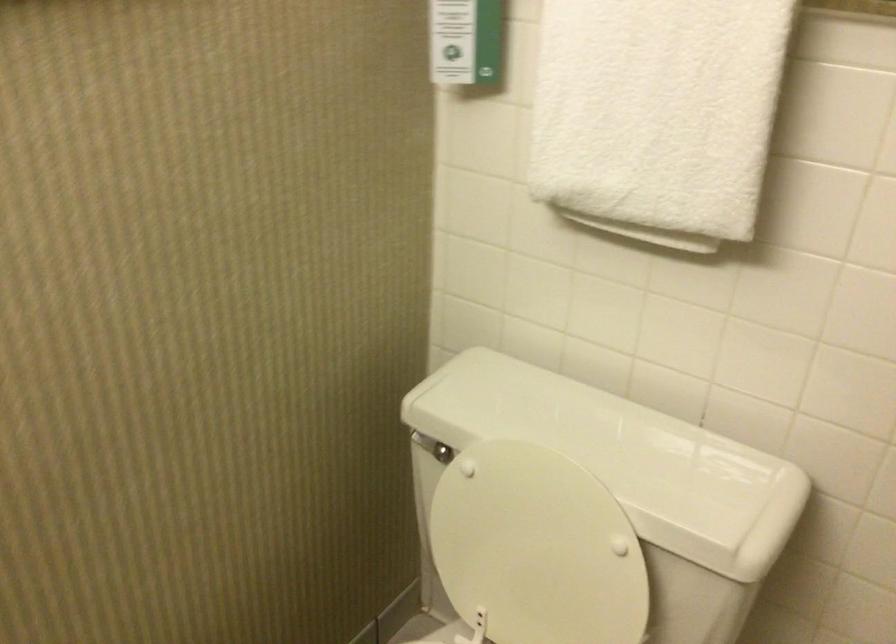
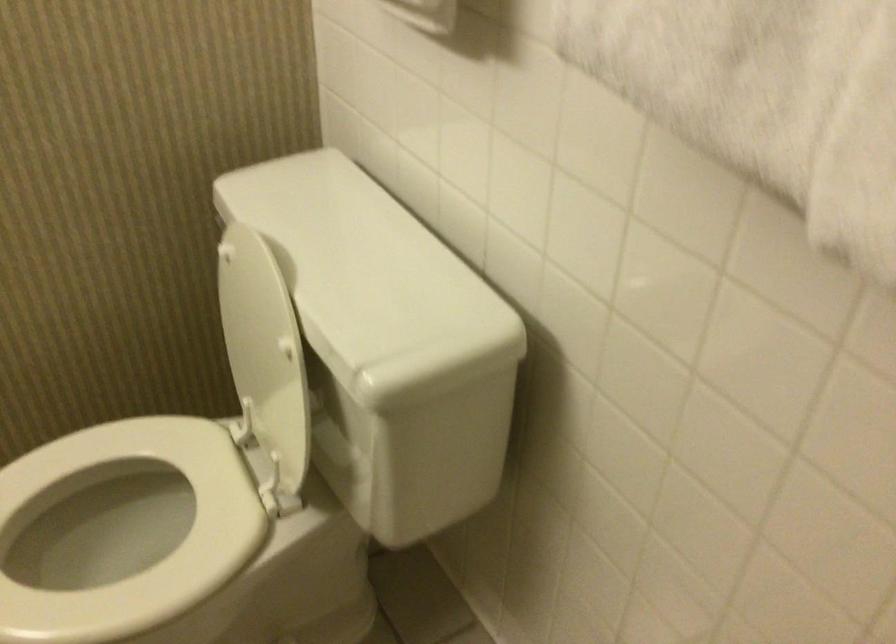
Where in the second image is the point corresponding to the point at 540,550 from the first image?

(259, 343)